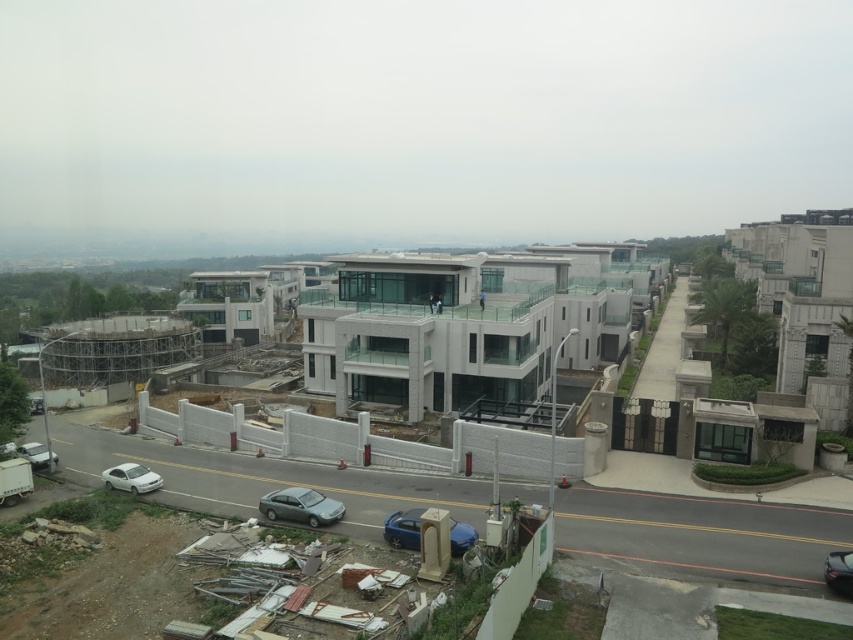
You are standing at the center of the road looking towards the construction site. You see a shiny black car at lower right and a silver metallic car at lower left. Which car is positioned to the right side of the other?

The shiny black car at lower right is positioned to the right of the silver metallic car at lower left.

You are standing at the center of the image. Which direction should you look to see the shiny black car at lower right?

The shiny black car at lower right is located at coordinates approximately 0.894 on the x axis and 0.984 on the y axis. Since you are at the center, you should look towards the lower right direction to see it.